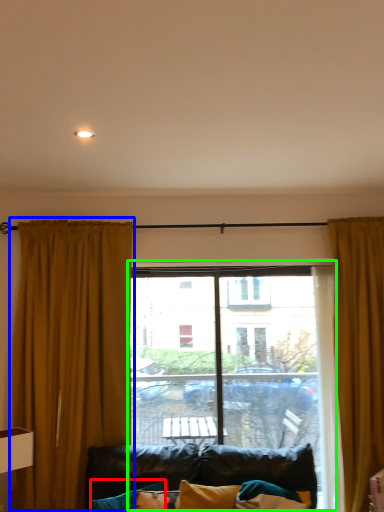
Question: Based on their relative distances, which object is nearer to pillow (highlighted by a red box)? Choose from curtain (highlighted by a blue box) and window (highlighted by a green box).

Choices:
 (A) curtain
 (B) window

Answer: (A)